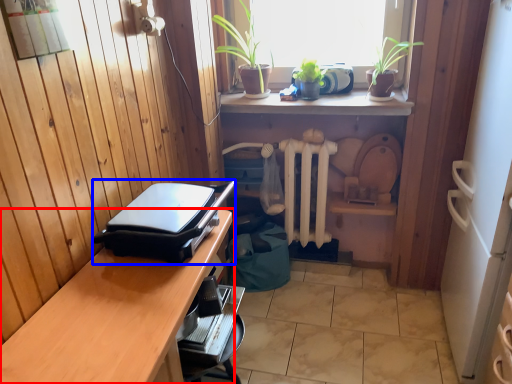
Question: Which point is closer to the camera, desk (highlighted by a red box) or appliance (highlighted by a blue box)?

Choices:
 (A) desk
 (B) appliance

Answer: (A)